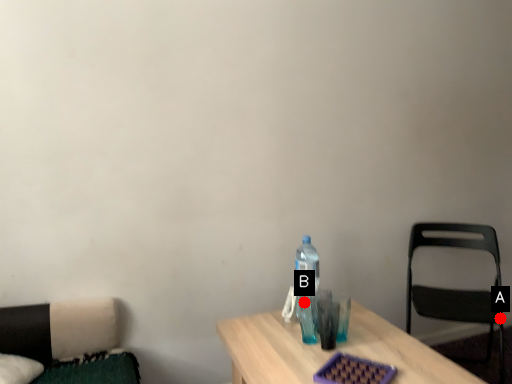
Question: Two points are circled on the image, labeled by A and B beside each circle. Which point is closer to the camera?

Choices:
 (A) A is closer
 (B) B is closer

Answer: (B)